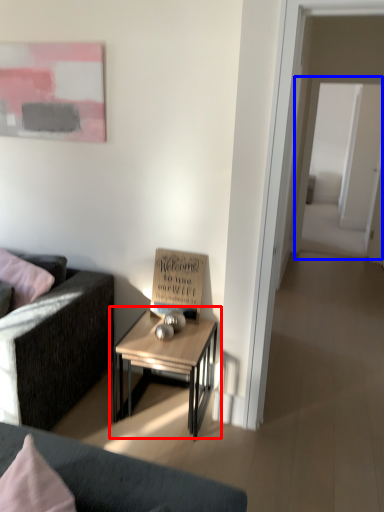
Question: Which point is further to the camera, table (highlighted by a red box) or glass door (highlighted by a blue box)?

Choices:
 (A) table
 (B) glass door

Answer: (B)